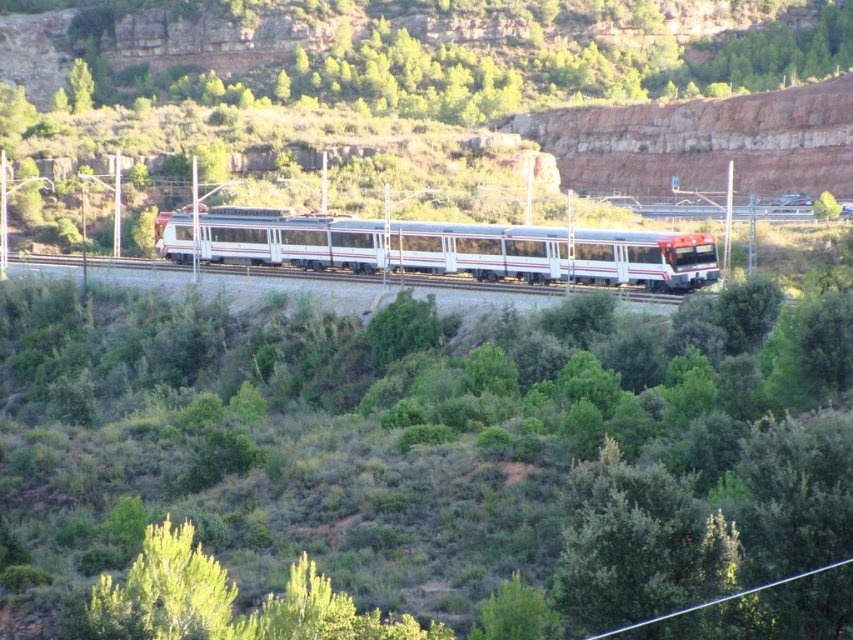
Is green leafy shrub at center to the right of white glossy train track at center from the viewer's perspective?

Yes, green leafy shrub at center is to the right of white glossy train track at center.

Who is more forward, (839, 426) or (653, 301)?

Point (839, 426) is in front.

At what (x,y) coordinates should I click in order to perform the action: click on green leafy shrub at center. Please return your answer as a coordinate pair (x, y). The image size is (853, 640). Looking at the image, I should click on click(x=434, y=458).

Who is higher up, white glossy train at center or white glossy train track at center?

white glossy train at center is higher up.

Can you confirm if white glossy train at center is taller than white glossy train track at center?

Indeed, white glossy train at center has a greater height compared to white glossy train track at center.

Does point (260, 216) come in front of point (433, 285)?

That is False.

You are a GUI agent. You are given a task and a screenshot of the screen. Output one action in this format:
    pyautogui.click(x=<x>, y=<y>)
    Task: Click on the white glossy train at center
    
    Given the screenshot: What is the action you would take?
    pyautogui.click(x=457, y=248)

Can you confirm if green leafy shrub at center is taller than white glossy train at center?

Indeed, green leafy shrub at center has a greater height compared to white glossy train at center.

Measure the distance from green leafy shrub at center to white glossy train at center.

green leafy shrub at center is 72.84 feet away from white glossy train at center.

Does point (531, 525) come farther from viewer compared to point (582, 241)?

No, it is in front of (582, 241).

The height and width of the screenshot is (640, 853). I want to click on green leafy shrub at center, so click(x=434, y=458).